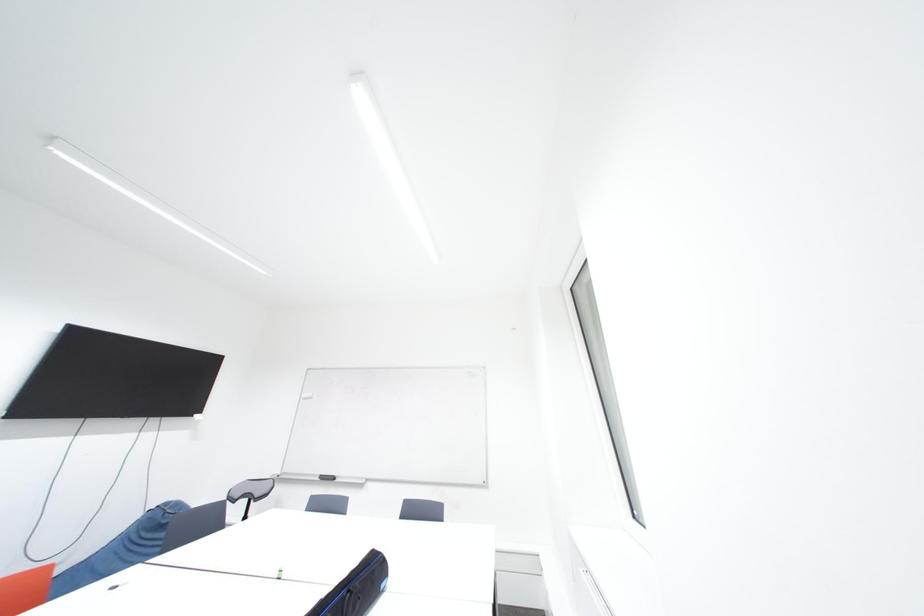
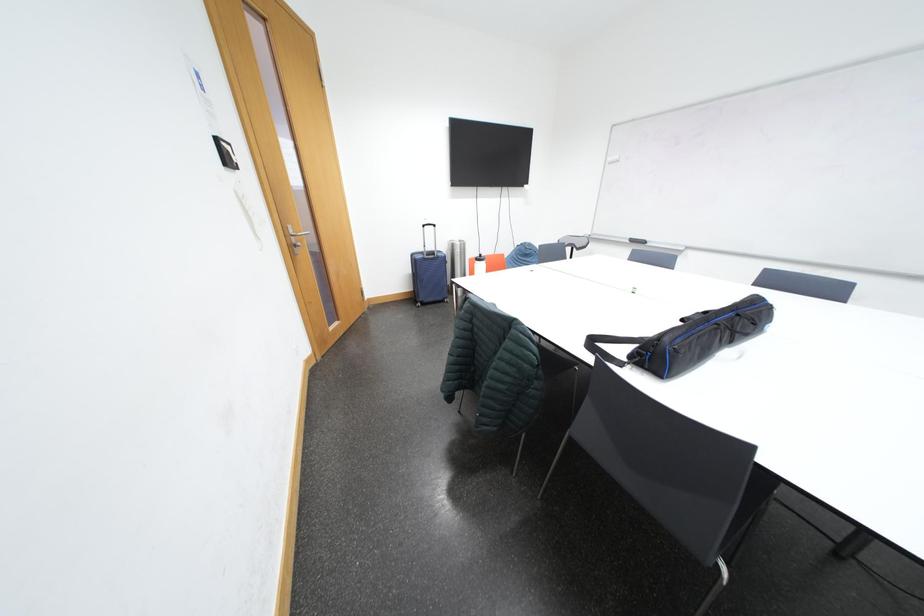
The images are taken continuously from a first-person perspective. In which direction is your viewpoint rotating?

The camera's rotation is toward left-down.